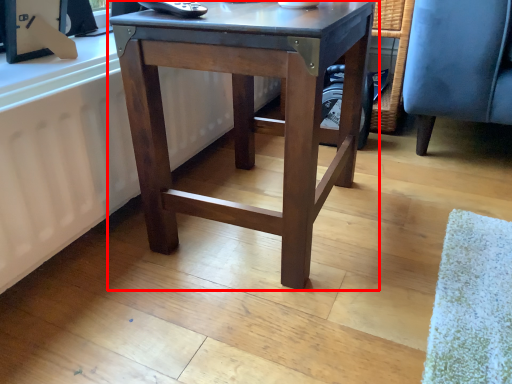
Question: From the image, what is the correct spatial relationship of table (annotated by the red box) in relation to radiator?

Choices:
 (A) right
 (B) left

Answer: (A)